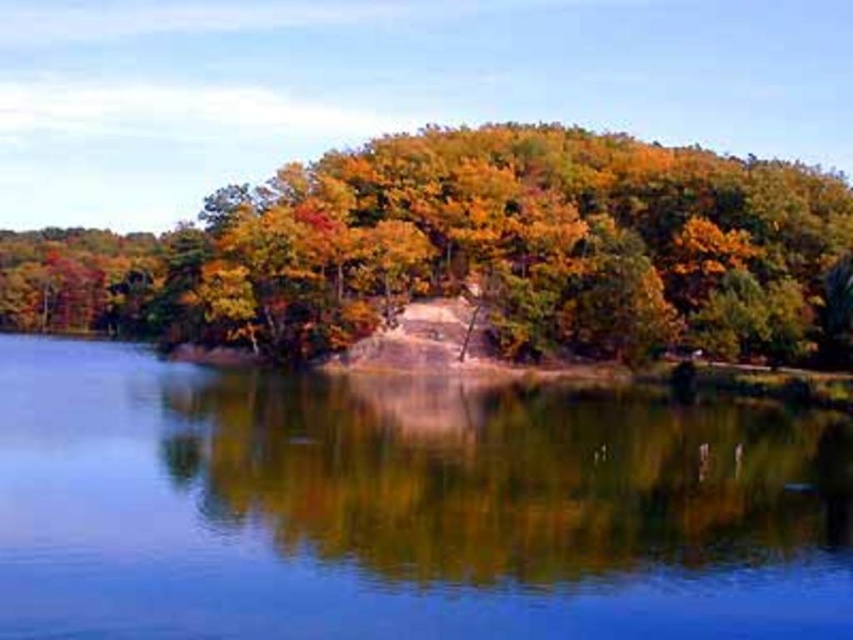
Locate an element on the screen. The height and width of the screenshot is (640, 853). clear water at center is located at coordinates (403, 508).

Does clear water at center appear under shiny golden leaves at center?

Indeed, clear water at center is positioned under shiny golden leaves at center.

You are a GUI agent. You are given a task and a screenshot of the screen. Output one action in this format:
    pyautogui.click(x=<x>, y=<y>)
    Task: Click on the clear water at center
    The height and width of the screenshot is (640, 853).
    Given the screenshot: What is the action you would take?
    pyautogui.click(x=403, y=508)